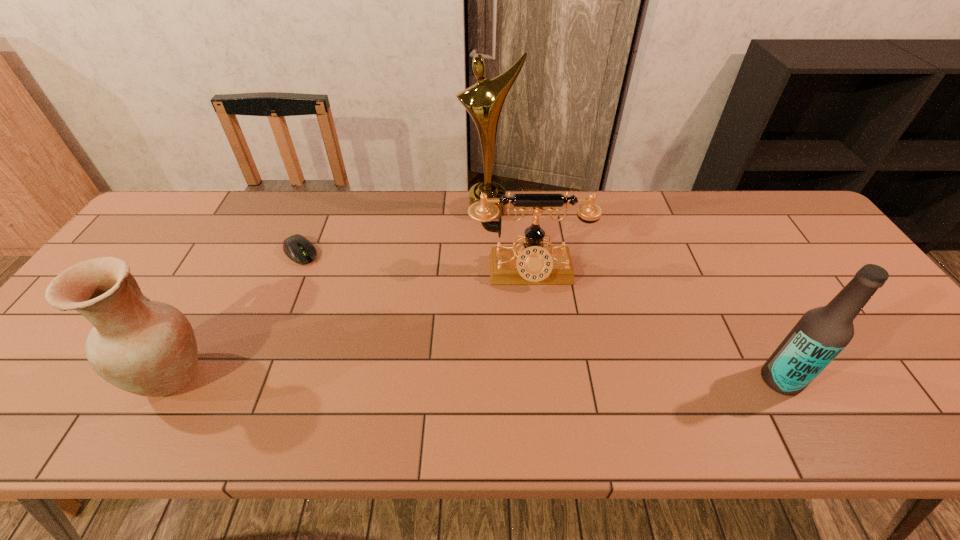
This screenshot has width=960, height=540. In order to click on the leftmost object in this screenshot , I will do `click(148, 348)`.

Identify the location of beer bottle. The width and height of the screenshot is (960, 540). (822, 333).

The image size is (960, 540). I want to click on computer mouse, so click(x=300, y=250).

Where is `the second object from left to right`? the second object from left to right is located at coordinates (300, 250).

I want to click on the tallest object, so click(x=484, y=101).

Identify the location of the farthest object. The height and width of the screenshot is (540, 960). coord(484,101).

Image resolution: width=960 pixels, height=540 pixels. I want to click on the fourth tallest object, so click(532, 263).

The width and height of the screenshot is (960, 540). Find the location of `free space located on the back of the pottery`. free space located on the back of the pottery is located at coordinates (217, 298).

Where is `vacant area situated on the side of the rightmost object with the label`? The width and height of the screenshot is (960, 540). vacant area situated on the side of the rightmost object with the label is located at coordinates (712, 380).

At what (x,y) coordinates should I click in order to perform the action: click on free space located on the side of the rightmost object with the label. Please return your answer as a coordinate pair (x, y). Looking at the image, I should click on (627, 380).